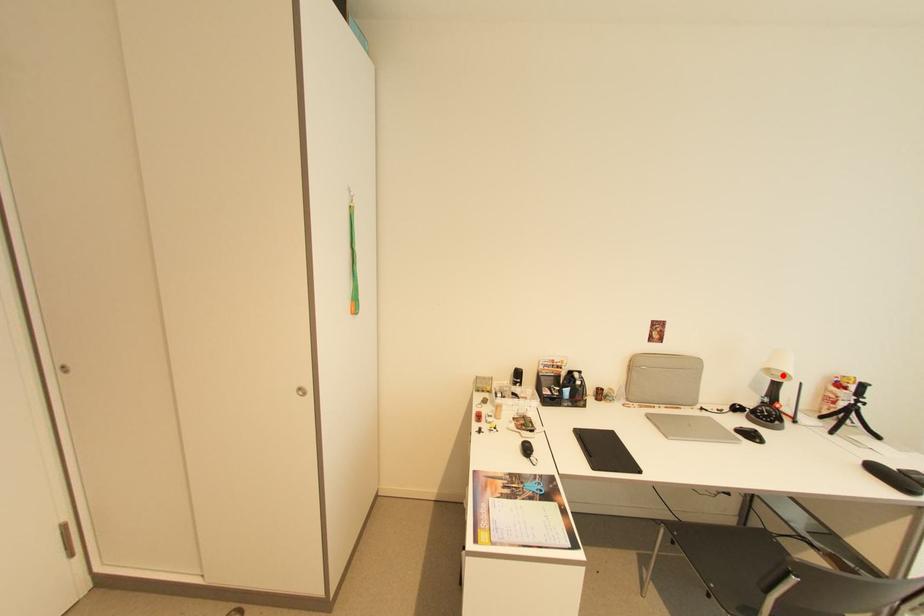
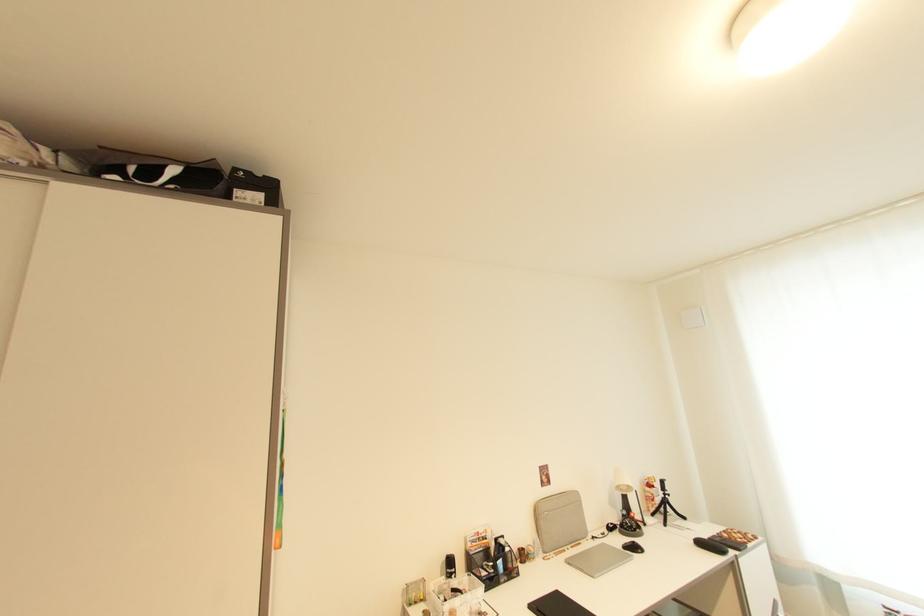
Where in the second image is the point corresponding to the highlighted location from the first image?

(629, 490)